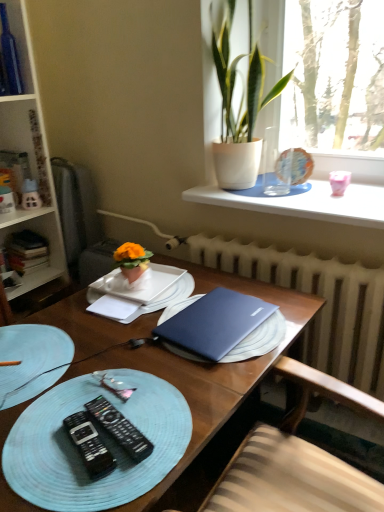
Question: Does green leafy plant at upper right, placed as the 2th houseplant when sorted from bottom to top, have a larger size compared to blue matte laptop at center?

Choices:
 (A) yes
 (B) no

Answer: (B)

Question: Considering the relative positions of green leafy plant at upper right, arranged as the 1th houseplant when viewed from the top, and blue matte laptop at center in the image provided, is green leafy plant at upper right, arranged as the 1th houseplant when viewed from the top, behind blue matte laptop at center?

Choices:
 (A) no
 (B) yes

Answer: (B)

Question: Considering the relative positions of green leafy plant at upper right, placed as the 2th houseplant when sorted from bottom to top, and blue matte laptop at center in the image provided, is green leafy plant at upper right, placed as the 2th houseplant when sorted from bottom to top, to the right of blue matte laptop at center from the viewer's perspective?

Choices:
 (A) no
 (B) yes

Answer: (B)

Question: Is green leafy plant at upper right, arranged as the 1th houseplant when viewed from the top, not inside blue matte laptop at center?

Choices:
 (A) no
 (B) yes

Answer: (B)

Question: Is green leafy plant at upper right, placed as the 2th houseplant when sorted from bottom to top, thinner than blue matte laptop at center?

Choices:
 (A) yes
 (B) no

Answer: (A)

Question: Considering the positions of matte glass globe at upper right, the second tableware when ordered from front to back, and light blue woven placemat at lower left in the image, is matte glass globe at upper right, the second tableware when ordered from front to back, wider or thinner than light blue woven placemat at lower left?

Choices:
 (A) thin
 (B) wide

Answer: (A)

Question: From a real-world perspective, is matte glass globe at upper right, the 2th tableware when ordered from bottom to top, positioned above or below light blue woven placemat at lower left?

Choices:
 (A) above
 (B) below

Answer: (A)

Question: Would you say matte glass globe at upper right, the second tableware when ordered from front to back, is to the left or to the right of light blue woven placemat at lower left in the picture?

Choices:
 (A) right
 (B) left

Answer: (A)

Question: In the image, is matte glass globe at upper right, the 2th tableware when ordered from bottom to top, positioned in front of or behind light blue woven placemat at lower left?

Choices:
 (A) front
 (B) behind

Answer: (B)

Question: Is matte glass globe at upper right, the first tableware from the top, inside or outside of blue matte laptop at center?

Choices:
 (A) inside
 (B) outside

Answer: (B)

Question: Considering the positions of matte glass globe at upper right, which is counted as the 1th tableware, starting from the right, and blue matte laptop at center in the image, is matte glass globe at upper right, which is counted as the 1th tableware, starting from the right, wider or thinner than blue matte laptop at center?

Choices:
 (A) wide
 (B) thin

Answer: (B)

Question: From the image's perspective, is matte glass globe at upper right, which is counted as the 1th tableware, starting from the right, positioned above or below blue matte laptop at center?

Choices:
 (A) above
 (B) below

Answer: (A)

Question: From a real-world perspective, is matte glass globe at upper right, which is the 2th tableware in left-to-right order, above or below blue matte laptop at center?

Choices:
 (A) above
 (B) below

Answer: (A)

Question: Considering the positions of satin blue laptop at center and white matte notebook at center in the image, is satin blue laptop at center bigger or smaller than white matte notebook at center?

Choices:
 (A) small
 (B) big

Answer: (B)

Question: Considering their positions, is satin blue laptop at center located in front of or behind white matte notebook at center?

Choices:
 (A) behind
 (B) front

Answer: (B)